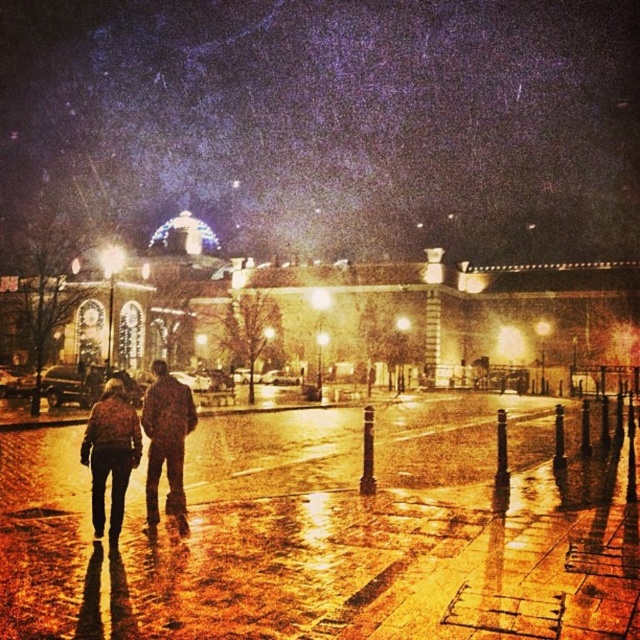
From the picture: You are a photographer trying to capture both the flannel shirt at center and the dark brown leather jacket at center in a single frame. Since you want to emphasize the size difference between them, which clothing item should you position closer to the camera to achieve this effect?

To emphasize the size difference between the flannel shirt at center and the dark brown leather jacket at center, you should position the flannel shirt at center closer to the camera since it is larger in size than the dark brown leather jacket at center.

You are standing in the plaza and want to reach the brown leather jacket at lower left. The plaza has a 30 meter limit for wheelchair access. Is the jacket within the wheelchair accessible area?

The brown leather jacket at lower left is 31.59 meters away from the viewer, which exceeds the 30 meter wheelchair access limit. Therefore, it is outside the accessible area.